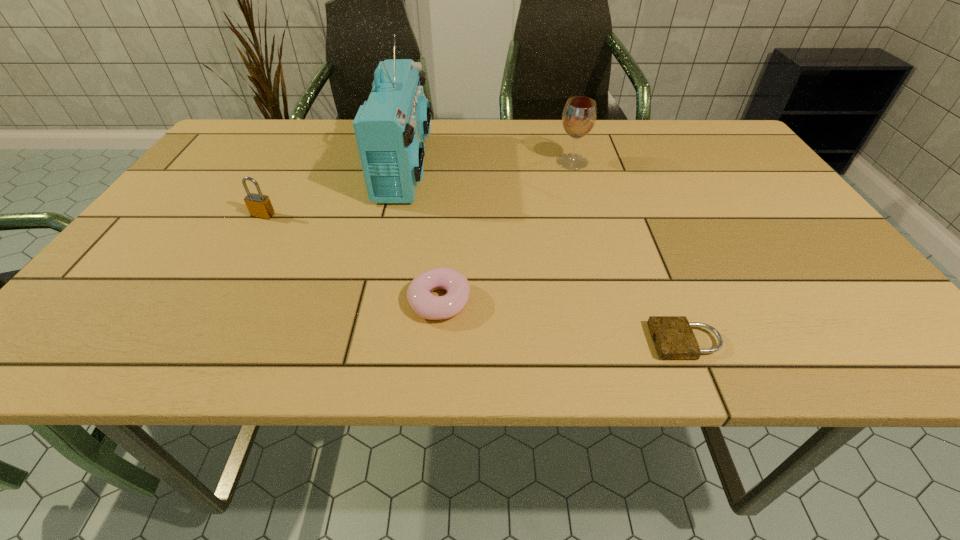
Identify the location of free space that satisfies the following two spatial constraints: 1. on the front side of the wineglass; 2. on the front-facing side of the radio receiver. The image size is (960, 540). (573, 167).

You are a GUI agent. You are given a task and a screenshot of the screen. Output one action in this format:
    pyautogui.click(x=<x>, y=<y>)
    Task: Click on the blank area in the image that satisfies the following two spatial constraints: 1. on the front side of the doughnut; 2. on the left side of the leftmost object
    The image size is (960, 540).
    Given the screenshot: What is the action you would take?
    click(x=214, y=301)

The height and width of the screenshot is (540, 960). Identify the location of free region that satisfies the following two spatial constraints: 1. on the back side of the doughnut; 2. on the right side of the fourth shortest object. (451, 162).